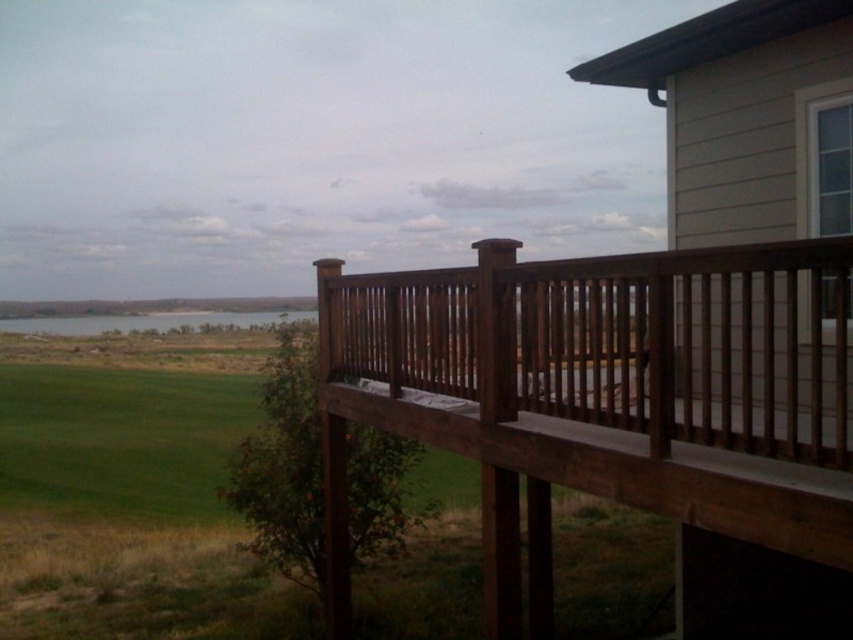
Does point (831, 467) come closer to viewer compared to point (117, 320)?

Yes, point (831, 467) is in front of point (117, 320).

Consider the image. Between brown wood porch at right and green grassy field at lower left, which one appears on the left side from the viewer's perspective?

green grassy field at lower left

You are a GUI agent. You are given a task and a screenshot of the screen. Output one action in this format:
    pyautogui.click(x=<x>, y=<y>)
    Task: Click on the brown wood porch at right
    
    Given the screenshot: What is the action you would take?
    pyautogui.click(x=610, y=419)